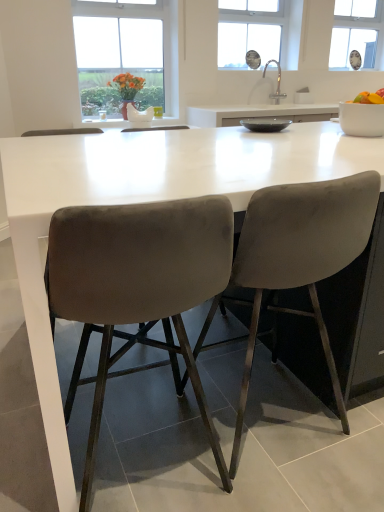
The image size is (384, 512). I want to click on free area below white ceramic sink at upper center (from a real-world perspective), so click(x=276, y=102).